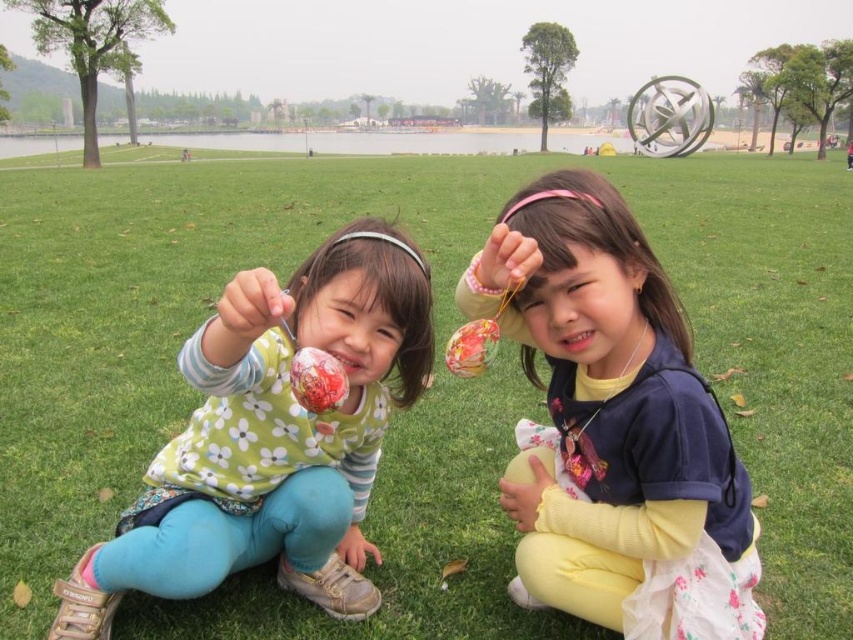
Measure the distance between point (663, 372) and camera.

The distance of point (663, 372) from camera is 6.60 feet.

Can you confirm if matte pink headband at center is shorter than multicolored glossy egg at center?

Incorrect, matte pink headband at center's height does not fall short of multicolored glossy egg at center's.

Which is in front, point (572, 480) or point (459, 369)?

Point (459, 369) is more forward.

Where is `matte pink headband at center`? The width and height of the screenshot is (853, 640). matte pink headband at center is located at coordinates (613, 426).

Is shiny plastic egg at center to the left of multicolored glossy egg at center from the viewer's perspective?

Correct, you'll find shiny plastic egg at center to the left of multicolored glossy egg at center.

Is point (316, 381) closer to camera compared to point (477, 328)?

Yes, point (316, 381) is in front of point (477, 328).

Locate an element on the screen. This screenshot has width=853, height=640. shiny plastic egg at center is located at coordinates (317, 380).

Does matte pink headband at center have a greater height compared to matte plastic hand at center?

Correct, matte pink headband at center is much taller as matte plastic hand at center.

Is point (625, 493) closer to camera compared to point (236, 310)?

That is False.

Which is in front, point (544, 353) or point (235, 324)?

Point (235, 324) is in front.

Where is `matte pink headband at center`? Image resolution: width=853 pixels, height=640 pixels. matte pink headband at center is located at coordinates (613, 426).